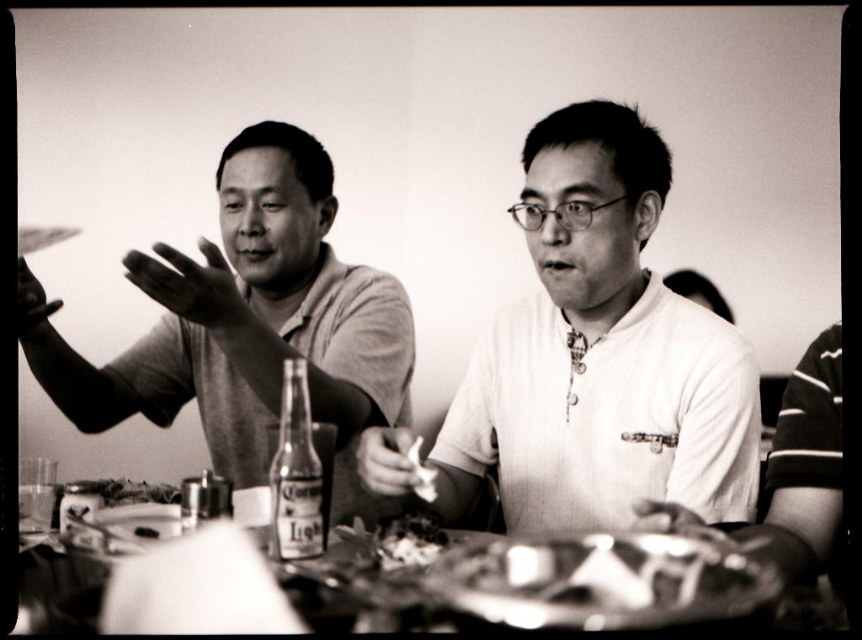
Between point (200, 252) and point (300, 625), which one is positioned in front?

Point (300, 625) is in front.

Between matte gray shirt at left and metallic silver tray at lower center, which one is positioned higher?

matte gray shirt at left

The height and width of the screenshot is (640, 862). Describe the element at coordinates (247, 323) in the screenshot. I see `matte gray shirt at left` at that location.

You are a GUI agent. You are given a task and a screenshot of the screen. Output one action in this format:
    pyautogui.click(x=<x>, y=<y>)
    Task: Click on the matte gray shirt at left
    Image resolution: width=862 pixels, height=640 pixels.
    Given the screenshot: What is the action you would take?
    pyautogui.click(x=247, y=323)

Can you confirm if metallic silver tray at lower center is shorter than dark textured food at center?

In fact, metallic silver tray at lower center may be taller than dark textured food at center.

Is point (447, 595) positioned after point (382, 520)?

No, (447, 595) is in front of (382, 520).

At what (x,y) coordinates should I click in order to perform the action: click on metallic silver tray at lower center. Please return your answer as a coordinate pair (x, y). Looking at the image, I should click on (420, 586).

Does metallic silver tray at lower center have a lesser height compared to smooth white plate at center?

No.

Which of these two, metallic silver tray at lower center or smooth white plate at center, stands shorter?

Standing shorter between the two is smooth white plate at center.

Locate an element on the screen. Image resolution: width=862 pixels, height=640 pixels. metallic silver tray at lower center is located at coordinates [x=420, y=586].